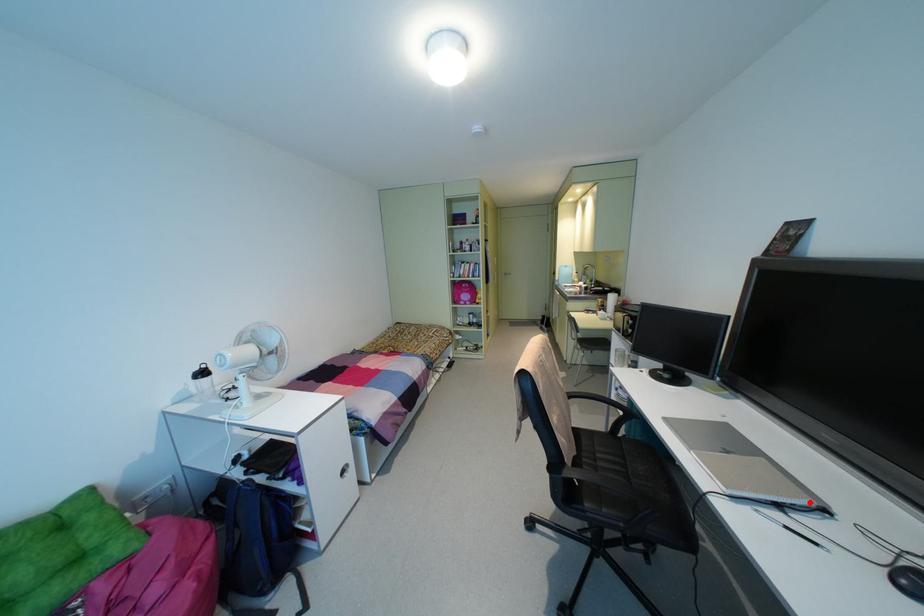
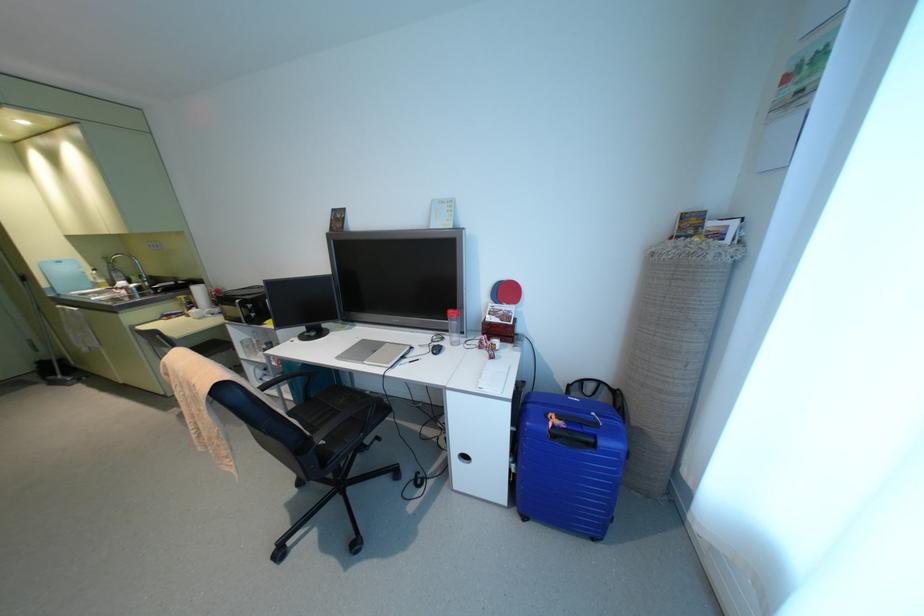
Question: I am providing you with two images of the same scene from different viewpoints. A red point is marked on the first image. Is the red point's position out of view in image 2?

Choices:
 (A) Yes
 (B) No

Answer: (B)